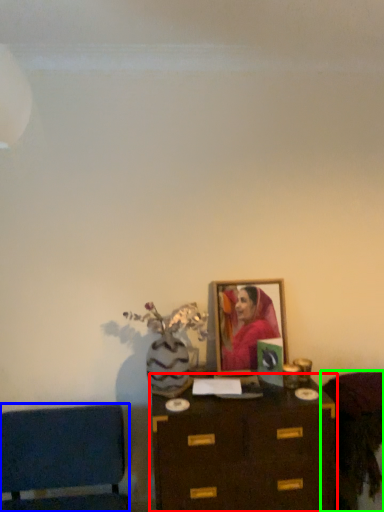
Question: Considering the real-world distances, which object is closest to table (highlighted by a red box)? furniture (highlighted by a blue box) or furniture (highlighted by a green box).

Choices:
 (A) furniture
 (B) furniture

Answer: (B)